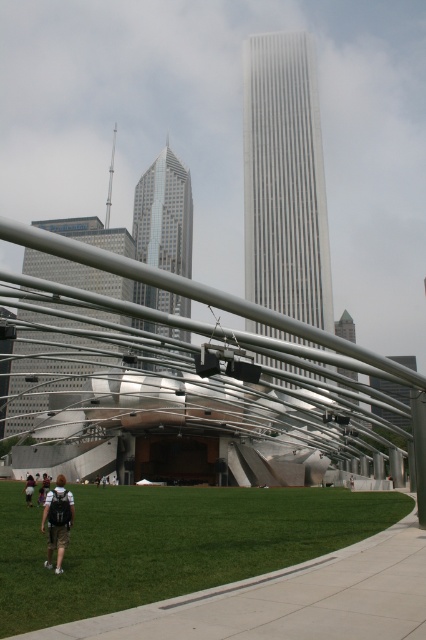
Question: Where is glassy steel skyscraper at center located in relation to dark brown backpack at lower left in the image?

Choices:
 (A) right
 (B) left

Answer: (B)

Question: Observing the image, what is the correct spatial positioning of green grass at lower left in reference to matte glass skyscraper at center?

Choices:
 (A) above
 (B) below

Answer: (B)

Question: Which point appears closest to the camera in this image?

Choices:
 (A) (284, 154)
 (B) (377, 384)
 (C) (172, 305)

Answer: (A)

Question: Which point is farther from the camera taking this photo?

Choices:
 (A) (160, 291)
 (B) (377, 406)
 (C) (120, 550)

Answer: (A)

Question: Is white glass skyscraper at center to the right of dark gray backpack at lower left from the viewer's perspective?

Choices:
 (A) yes
 (B) no

Answer: (A)

Question: Based on their relative distances, which object is nearer to the white glass skyscraper at center?

Choices:
 (A) glassy steel skyscraper at center
 (B) green grass at lower left

Answer: (B)